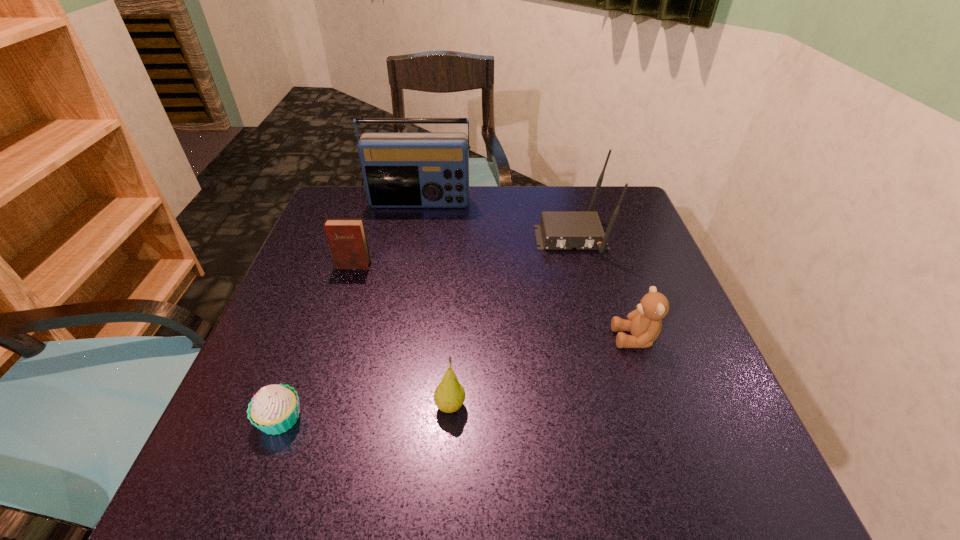
Find the location of a particular element. The height and width of the screenshot is (540, 960). empty space that is in between the shortest object and the tallest object is located at coordinates (350, 311).

The width and height of the screenshot is (960, 540). In order to click on blank region between the diary and the teddy bear in this screenshot , I will do `click(494, 302)`.

Where is `vacant area between the pear and the second tallest object`? The image size is (960, 540). vacant area between the pear and the second tallest object is located at coordinates (511, 322).

Select which object appears as the closest to the router. Please provide its 2D coordinates. Your answer should be formatted as a tuple, i.e. [(x, y)], where the tuple contains the x and y coordinates of a point satisfying the conditions above.

[(400, 169)]

Identify which object is the nearest to the pear. Please provide its 2D coordinates. Your answer should be formatted as a tuple, i.e. [(x, y)], where the tuple contains the x and y coordinates of a point satisfying the conditions above.

[(274, 409)]

I want to click on vacant space that satisfies the following two spatial constraints: 1. on the front panel of the radio receiver; 2. on the right side of the pear, so click(x=382, y=406).